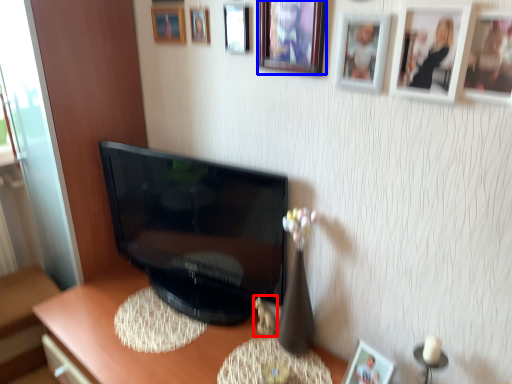
Question: Among these objects, which one is nearest to the camera, toy (highlighted by a red box) or picture frame (highlighted by a blue box)?

Choices:
 (A) toy
 (B) picture frame

Answer: (B)